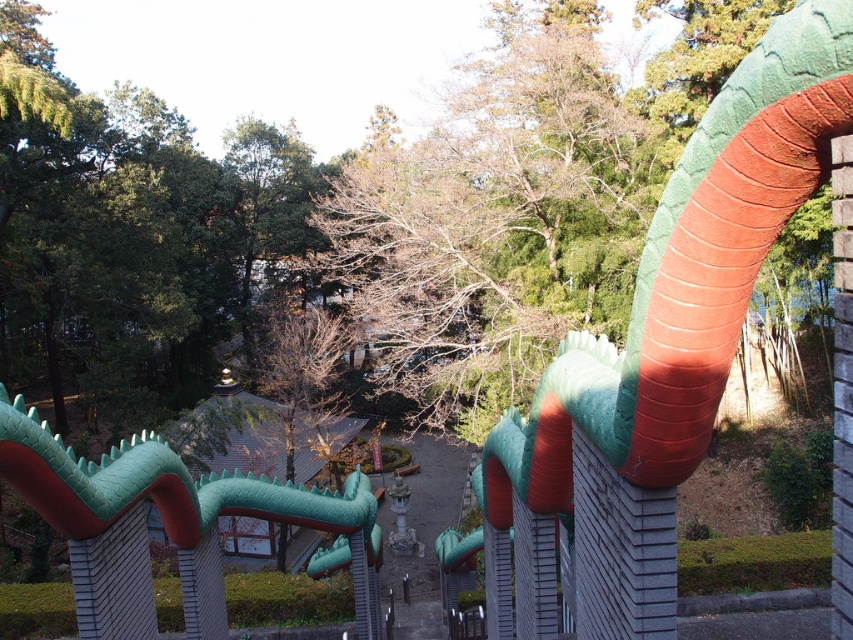
You are a visitor in the garden and want to take a photo of both the green matte snake at upper center and the green matte dragon at center. Which object will require you to zoom in more to include its entire form in the photo?

The green matte snake at upper center will require you to zoom in more because it occupies less space than the green matte dragon at center, meaning it appears smaller in the frame and needs a closer focus to capture its entire form.

You are standing in the Japanese garden and want to take a photo of both the green matte snake at upper center and the green matte dragon at center. Which one should you focus on first to ensure both are in clear view?

You should focus on the green matte dragon at center first because the green matte snake at upper center is closer to the viewer. By focusing on the farther object, you can capture both in focus using a smaller aperture or adjusting the focal point to the dragon, ensuring the snake in the foreground is also sharp.